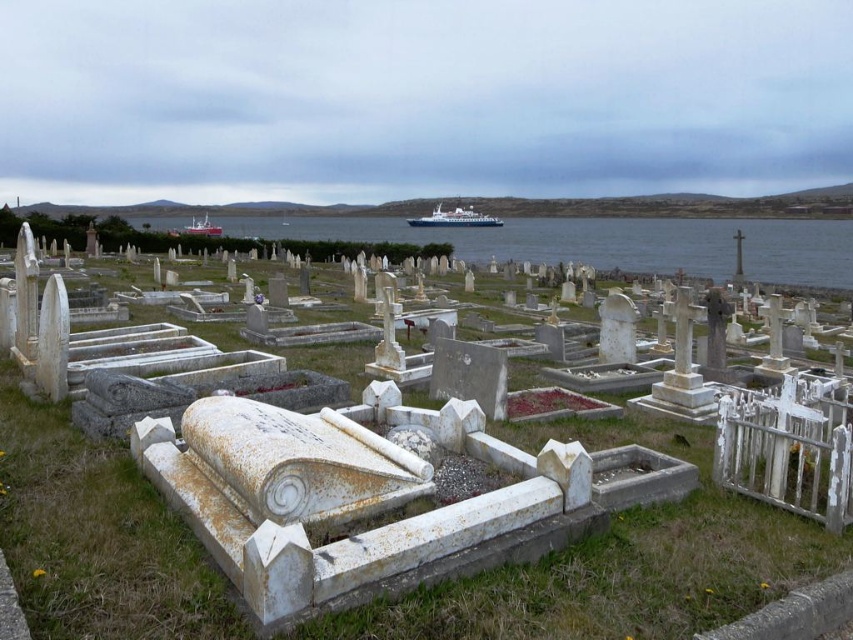
In the scene shown: You are standing in the cemetery and notice the white marble tombstones at center and the white plastic boat at center. Which object is smaller in size?

The white marble tombstones at center are smaller in size compared to the white plastic boat at center according to the description.